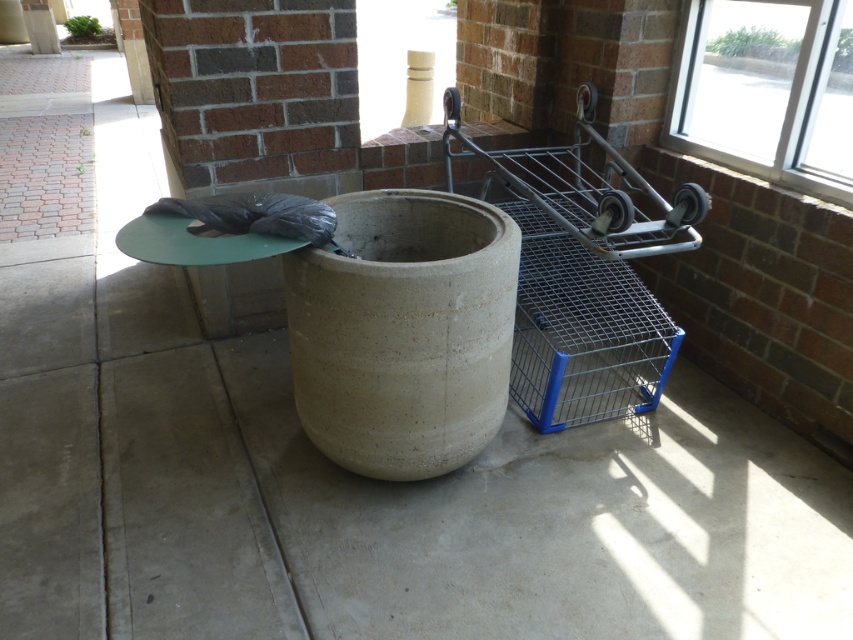
You are a maintenance worker needing to access the metallic wire cart at right and the transparent glass window at upper right. Which object is positioned higher from the ground?

The transparent glass window at upper right is positioned higher from the ground than the metallic wire cart at right, as the metallic wire cart at right is located below it.